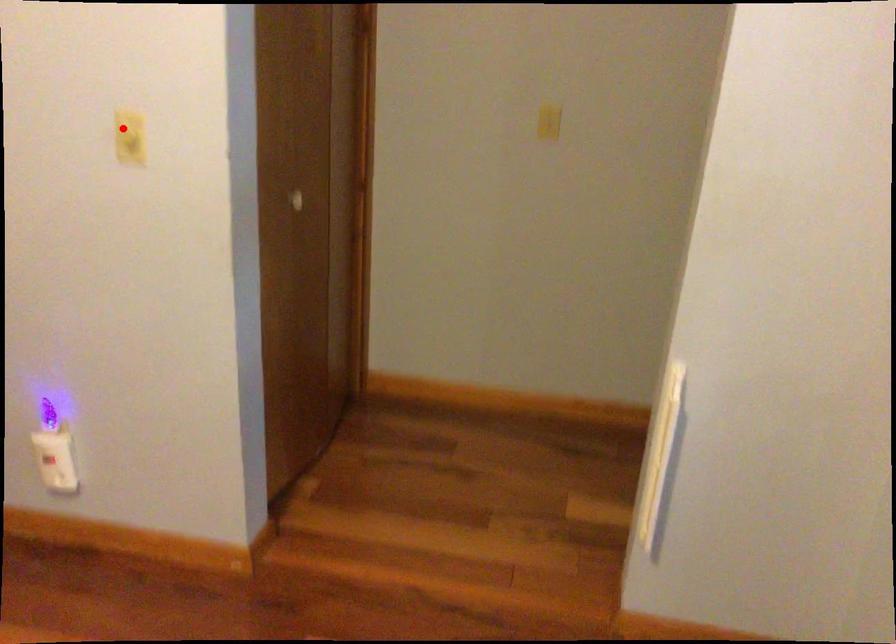
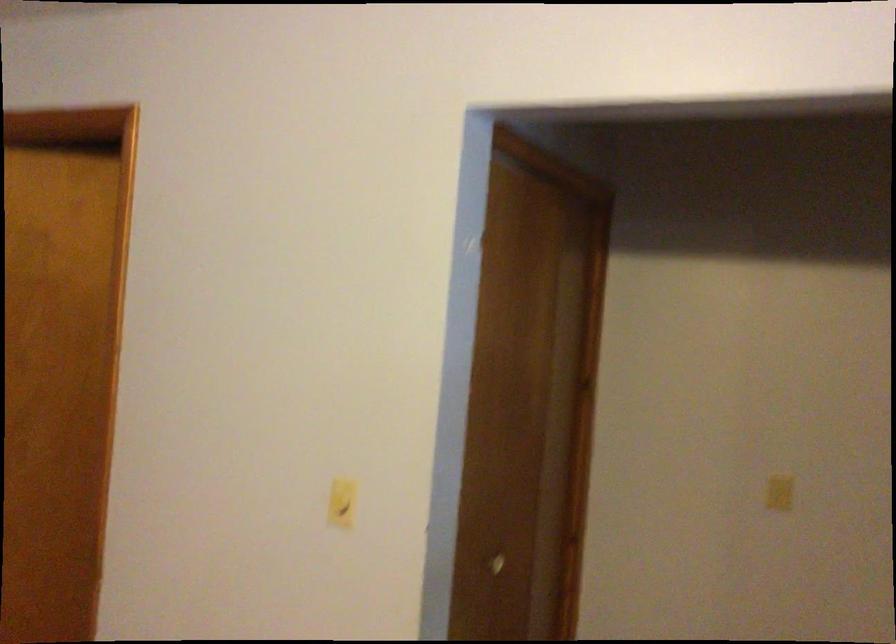
The point at the highlighted location is marked in the first image. Where is the corresponding point in the second image?

(340, 502)